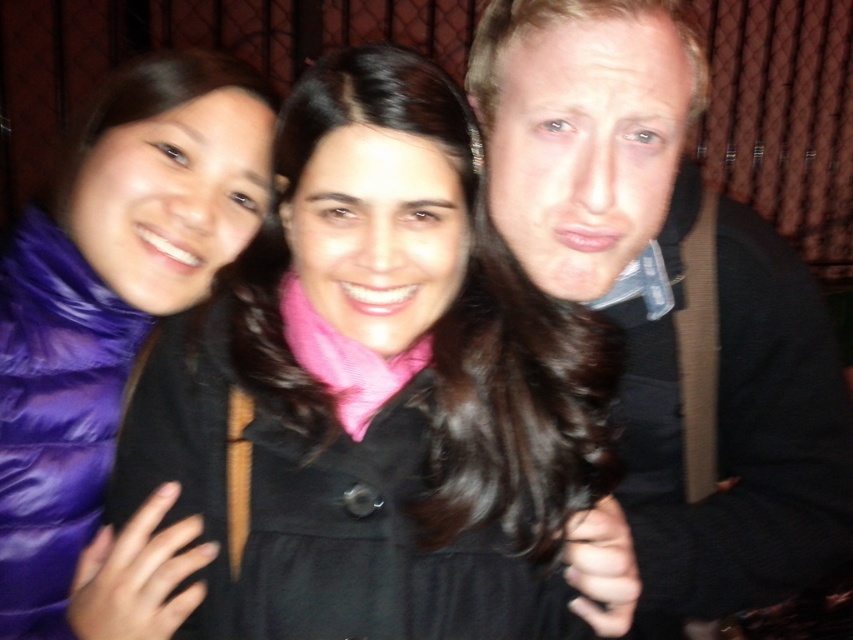
Between matte black coat at center and purple down jacket at left, which one is positioned lower?

matte black coat at center is below.

Can you confirm if matte black coat at center is smaller than purple down jacket at left?

Correct, matte black coat at center occupies less space than purple down jacket at left.

This screenshot has width=853, height=640. Describe the element at coordinates (376, 388) in the screenshot. I see `matte black coat at center` at that location.

Identify the location of matte black coat at center. The width and height of the screenshot is (853, 640). (376, 388).

Can you confirm if smooth black shirt at center is positioned to the left of purple down jacket at left?

Incorrect, smooth black shirt at center is not on the left side of purple down jacket at left.

Does point (680, 589) lie behind point (117, 116)?

That is False.

Where is `smooth black shirt at center`? smooth black shirt at center is located at coordinates (670, 301).

Is matte black coat at center below smooth black shirt at center?

No, matte black coat at center is not below smooth black shirt at center.

Does point (413, 548) come in front of point (724, 330)?

Yes, point (413, 548) is closer to viewer.

Image resolution: width=853 pixels, height=640 pixels. What do you see at coordinates (376, 388) in the screenshot? I see `matte black coat at center` at bounding box center [376, 388].

The width and height of the screenshot is (853, 640). What are the coordinates of `matte black coat at center` in the screenshot? It's located at (376, 388).